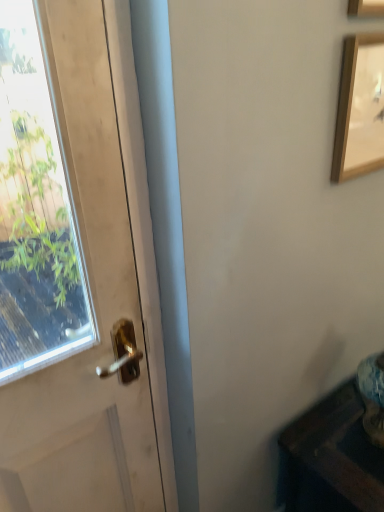
Question: From a real-world perspective, is white matte door at left located higher than wooden picture frame at upper right, acting as the first picture frame starting from the top?

Choices:
 (A) no
 (B) yes

Answer: (A)

Question: From the image's perspective, is white matte door at left located beneath wooden picture frame at upper right, the 2th picture frame positioned from the bottom?

Choices:
 (A) yes
 (B) no

Answer: (A)

Question: Is white matte door at left positioned before wooden picture frame at upper right, acting as the first picture frame starting from the top?

Choices:
 (A) no
 (B) yes

Answer: (B)

Question: Is white matte door at left facing away from wooden picture frame at upper right, the 2th picture frame positioned from the bottom?

Choices:
 (A) yes
 (B) no

Answer: (B)

Question: Could you tell me if white matte door at left is facing wooden picture frame at upper right, the 2th picture frame positioned from the bottom?

Choices:
 (A) no
 (B) yes

Answer: (A)

Question: Is white matte door at left shorter than wooden picture frame at upper right, the 2th picture frame positioned from the bottom?

Choices:
 (A) no
 (B) yes

Answer: (A)

Question: Would you say wooden picture frame at upper right, which appears as the first picture frame when ordered from the bottom, is part of wooden picture frame at upper right, acting as the first picture frame starting from the top,'s contents?

Choices:
 (A) yes
 (B) no

Answer: (B)

Question: Is wooden picture frame at upper right, the 2th picture frame positioned from the bottom, beside wooden picture frame at upper right, the second picture frame viewed from the top?

Choices:
 (A) no
 (B) yes

Answer: (A)

Question: From the image's perspective, would you say wooden picture frame at upper right, acting as the first picture frame starting from the top, is shown under wooden picture frame at upper right, the second picture frame viewed from the top?

Choices:
 (A) no
 (B) yes

Answer: (A)

Question: Is wooden picture frame at upper right, the 2th picture frame positioned from the bottom, positioned before wooden picture frame at upper right, the second picture frame viewed from the top?

Choices:
 (A) no
 (B) yes

Answer: (B)

Question: Could you tell me if wooden picture frame at upper right, acting as the first picture frame starting from the top, is turned towards wooden picture frame at upper right, the second picture frame viewed from the top?

Choices:
 (A) yes
 (B) no

Answer: (B)

Question: From a real-world perspective, is wooden picture frame at upper right, the 2th picture frame positioned from the bottom, located beneath wooden picture frame at upper right, the second picture frame viewed from the top?

Choices:
 (A) no
 (B) yes

Answer: (A)

Question: Is the depth of wooden picture frame at upper right, acting as the first picture frame starting from the top, less than that of white matte door at left?

Choices:
 (A) no
 (B) yes

Answer: (A)